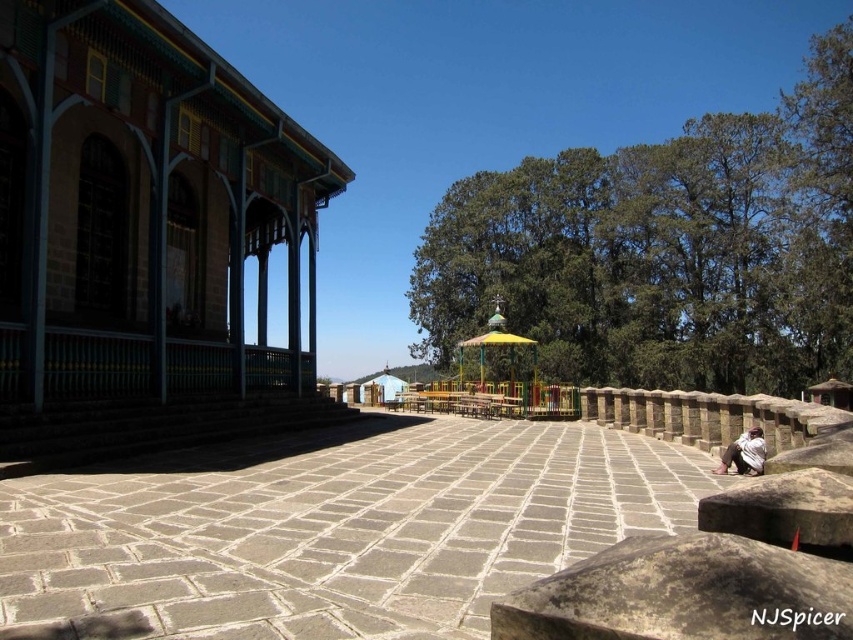
You are standing at a point 9.87 meters away from the camera. Based on the scene description, can you identify the exact location of the point labeled as point (756, 432) in the image?

The point (756, 432) is located 9.87 meters away from the camera in the scene.

You are planning to place a white cotton shirt at lower right on the ground near the green leafy tree at center. Considering the space between them, will the shirt be fully visible from the tree? Please explain your reasoning.

The green leafy tree at center might be wider than the white cotton shirt at lower right. If the tree is wider, it could potentially block the view of the shirt depending on its spread. However, without exact measurements, it is uncertain. The shirt might be partially or fully visible depending on the tree canopy coverage.